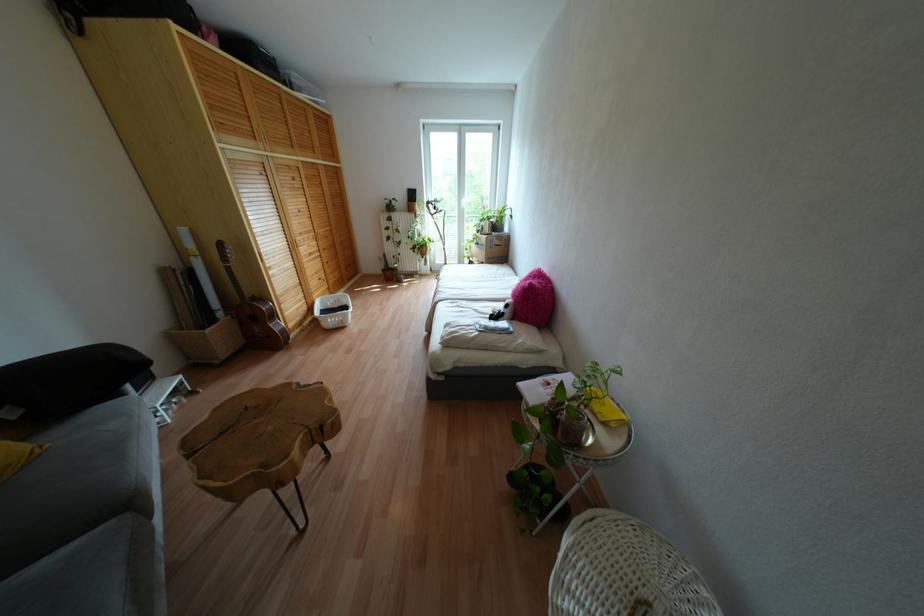
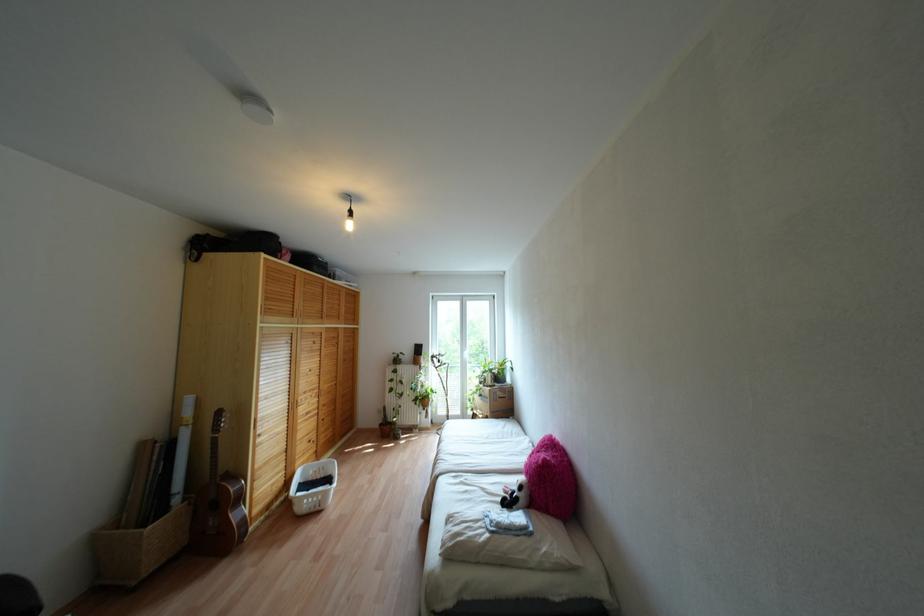
Where in the second image is the point corresponding to (x=285, y=314) from the first image?

(253, 495)